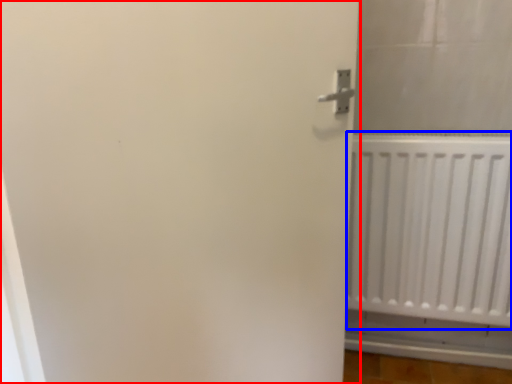
Question: Which point is further to the camera, door (highlighted by a red box) or radiator (highlighted by a blue box)?

Choices:
 (A) door
 (B) radiator

Answer: (B)